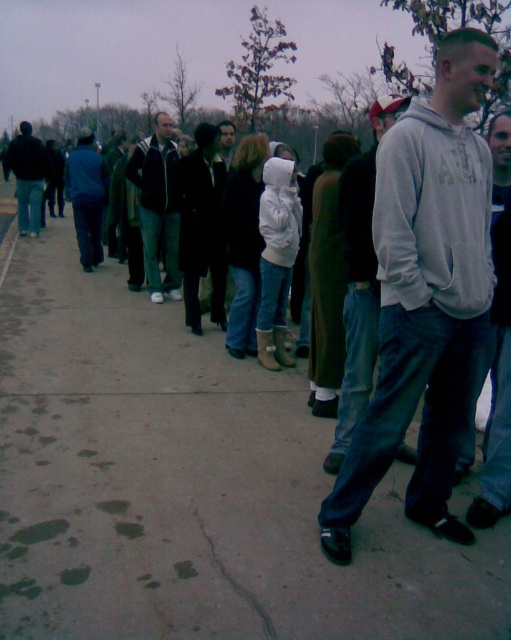
Is gray sweatshirt at center to the left of dark blue jeans at left from the viewer's perspective?

Incorrect, gray sweatshirt at center is not on the left side of dark blue jeans at left.

Describe the element at coordinates (426, 296) in the screenshot. I see `gray sweatshirt at center` at that location.

At what (x,y) coordinates should I click in order to perform the action: click on gray sweatshirt at center. Please return your answer as a coordinate pair (x, y). The width and height of the screenshot is (511, 640). Looking at the image, I should click on (426, 296).

Between gray hoodie at center and dark blue jeans at left, which one is positioned lower?

gray hoodie at center is lower down.

Between gray hoodie at center and dark blue jeans at left, which one is positioned higher?

Positioned higher is dark blue jeans at left.

What do you see at coordinates (360, 280) in the screenshot? I see `gray hoodie at center` at bounding box center [360, 280].

Find the location of a particular element. The width and height of the screenshot is (511, 640). gray hoodie at center is located at coordinates (360, 280).

Does point (97, 362) come farther from viewer compared to point (73, 173)?

That is False.

Who is shorter, gray concrete sidewalk at center or blue denim jeans at left?

With less height is gray concrete sidewalk at center.

Does point (65, 538) lie behind point (87, 156)?

No, (65, 538) is in front of (87, 156).

Where is `gray concrete sidewalk at center`? The height and width of the screenshot is (640, 511). gray concrete sidewalk at center is located at coordinates (191, 486).